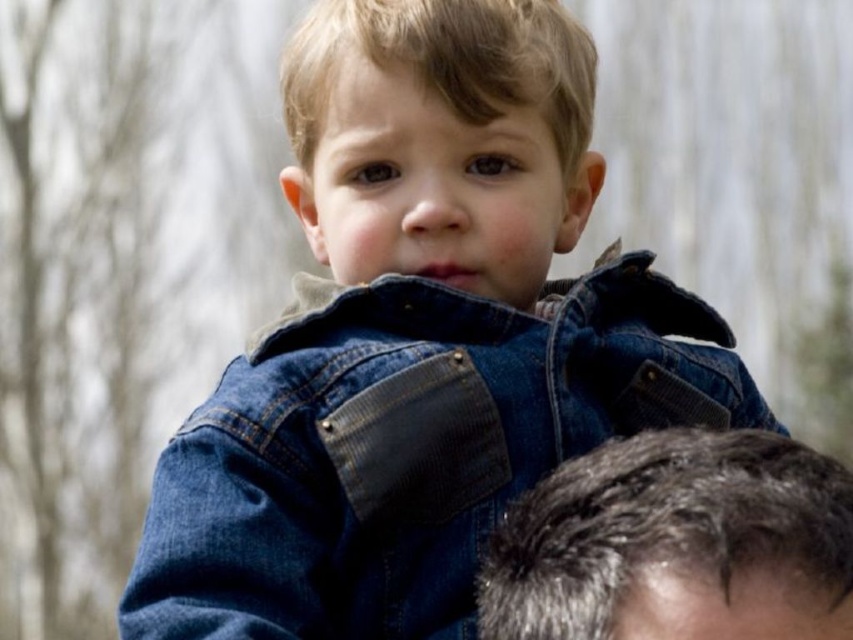
Based on the scene description, which object occupies more horizontal space in the image? Please choose between the denim jacket at center and the gray hair at upper right.

The denim jacket at center has a greater width than the gray hair at upper right, so it occupies more horizontal space in the image.

You are a photographer trying to capture a candid shot of the child in the scene. The camera you are using has a focal length of 50mm and an aperture of f2.8. To ensure the subject is in focus, you need to adjust the distance between the camera and the child. Given the camera settings and the distance between the point at (393, 316) and the adult, what is the minimum distance you should maintain to keep the child sharp?

The minimum distance to keep the child sharp would be determined by the hyperfocal distance formula, which requires knowing the acceptable circle of confusion for your camera sensor. Without that specific data, a general rule is to focus at the child and ensure the distance is no less than 1.82 meters, as that is the separation between the child and the adult. This maintains depth of field to keep both subject and background relatively sharp.

You are a photographer who wants to capture a closeup of the gray hair at upper right without the denim jacket at center blocking it. What adjustment should you make to your camera angle?

Move the camera angle so that it is positioned to the side of the denim jacket at center, allowing the gray hair at upper right to be visible without obstruction.